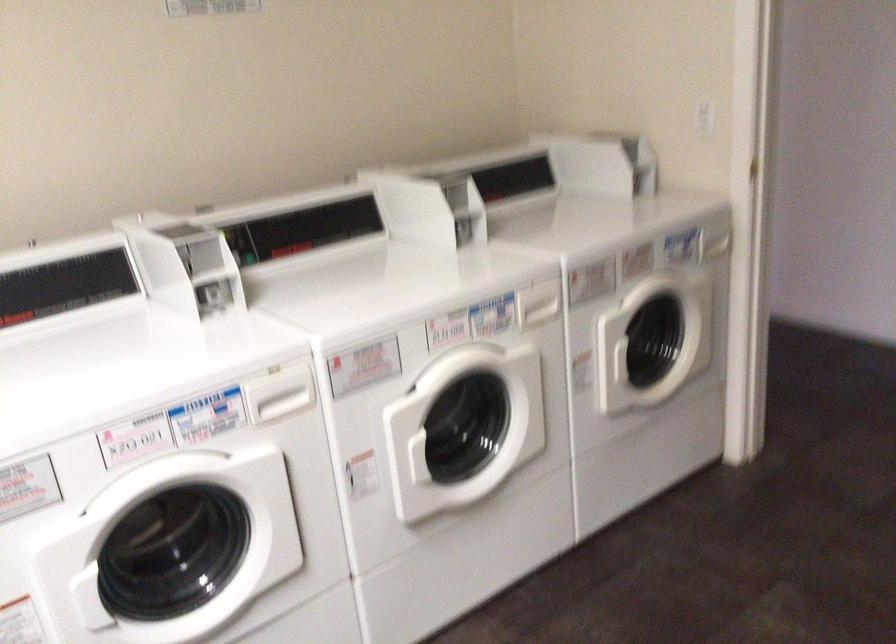
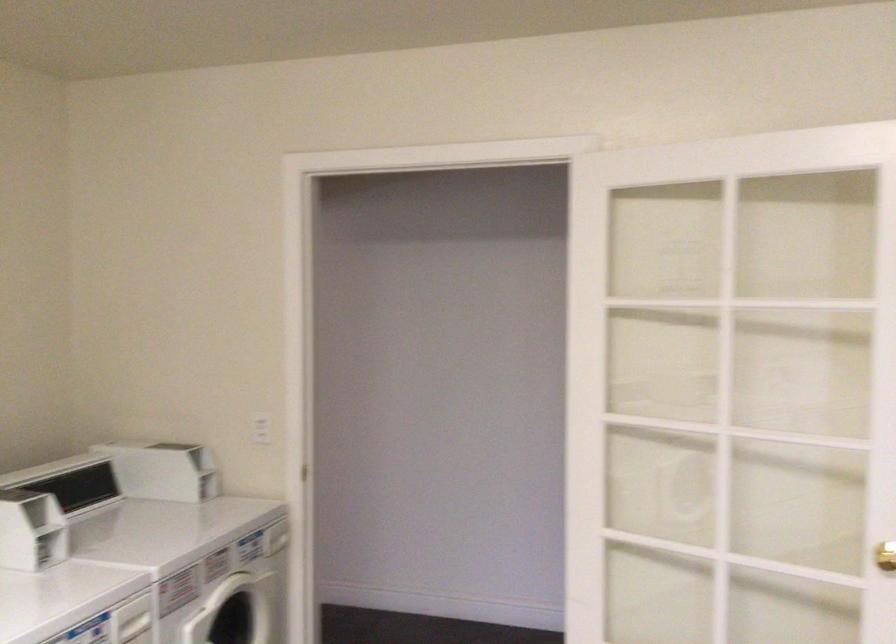
Find the pixel in the second image that matches pixel 694 113 in the first image.

(261, 428)